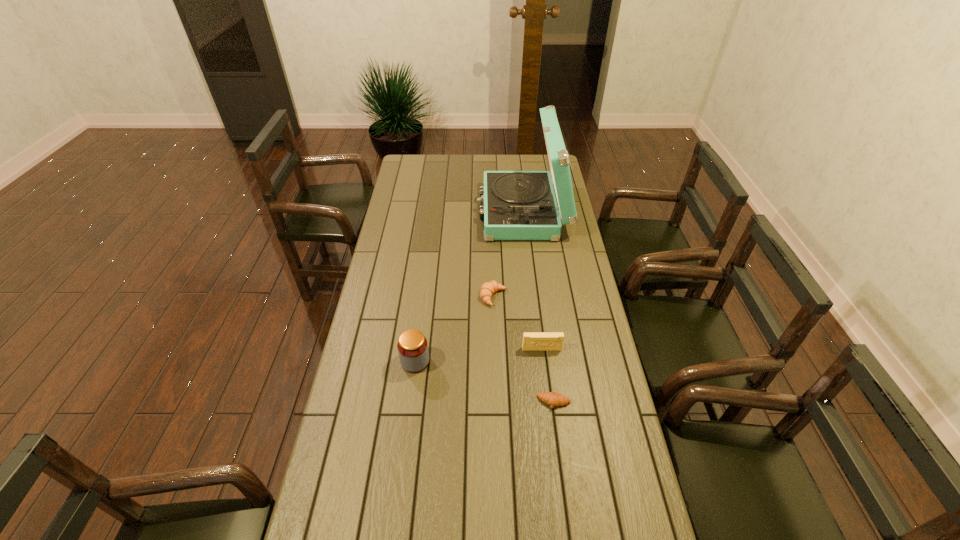
You are a GUI agent. You are given a task and a screenshot of the screen. Output one action in this format:
    pyautogui.click(x=<x>, y=<y>)
    Task: Click on the vacant space that's between the farther crescent roll and the leftmost object
    Image resolution: width=960 pixels, height=540 pixels.
    Given the screenshot: What is the action you would take?
    pyautogui.click(x=454, y=329)

This screenshot has height=540, width=960. What are the coordinates of `vacant area between the record player and the nearer crescent roll` in the screenshot? It's located at (539, 307).

You are a GUI agent. You are given a task and a screenshot of the screen. Output one action in this format:
    pyautogui.click(x=<x>, y=<y>)
    Task: Click on the object that is the closest one to the tallest object
    This screenshot has height=540, width=960.
    Given the screenshot: What is the action you would take?
    pyautogui.click(x=488, y=289)

Choose which object is the nearest neighbor to the fourth shortest object. Please provide its 2D coordinates. Your answer should be formatted as a tuple, i.e. [(x, y)], where the tuple contains the x and y coordinates of a point satisfying the conditions above.

[(488, 289)]

Locate an element on the screen. This screenshot has height=540, width=960. free space in the image that satisfies the following two spatial constraints: 1. on the face side of the record player; 2. on the left side of the shorter crescent roll is located at coordinates (544, 402).